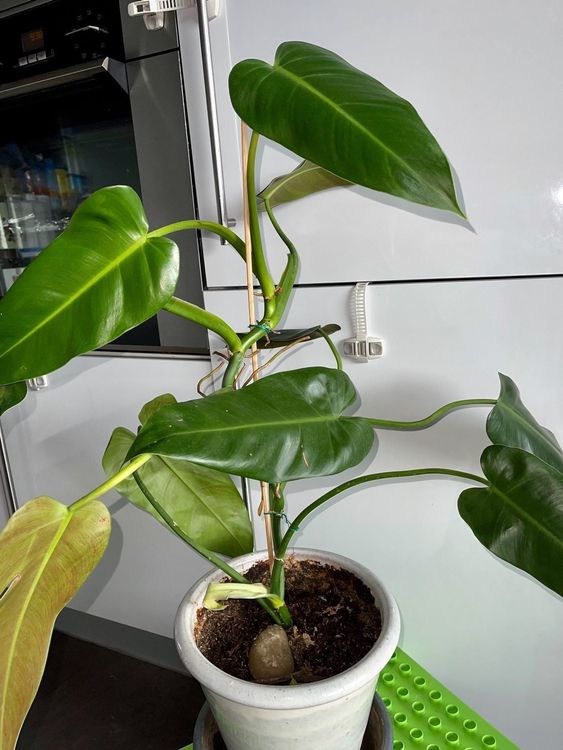
The width and height of the screenshot is (563, 750). Identify the location of pot. (293, 699).